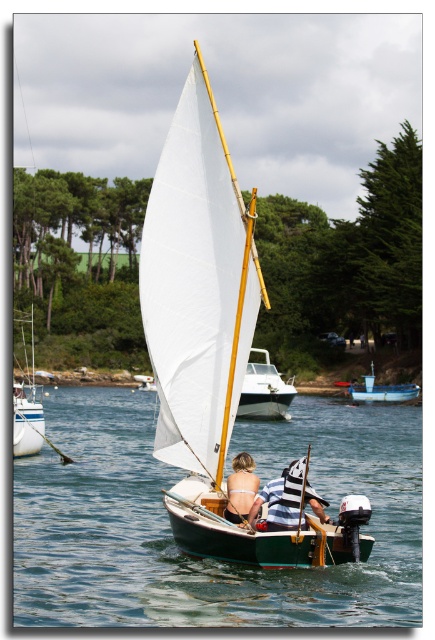
You are planning to cross the clear blue water at center in the white plastic boat at left. Based on the scene description, can the boat safely navigate the width of the water?

The clear blue water at center might be wider than the white plastic boat at left, so there is a possibility that the boat may not be able to safely navigate the width of the water if it is indeed wider. However, the exact width isn

You are planning to launch a small toy boat into the water. The clear blue water at center is where you want to place it. However, you notice the white plastic boat at left. Considering their heights, which one is lower and thus suitable for placing the toy boat?

The clear blue water at center has a lesser height compared to the white plastic boat at left, so it is lower and suitable for placing the toy boat.